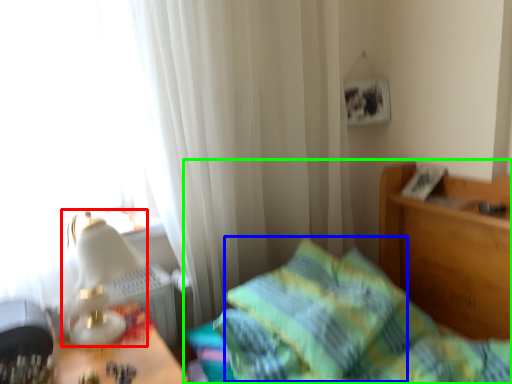
Question: Which is farther away from table lamp (highlighted by a red box)? pillow (highlighted by a blue box) or bed (highlighted by a green box)?

Choices:
 (A) pillow
 (B) bed

Answer: (B)